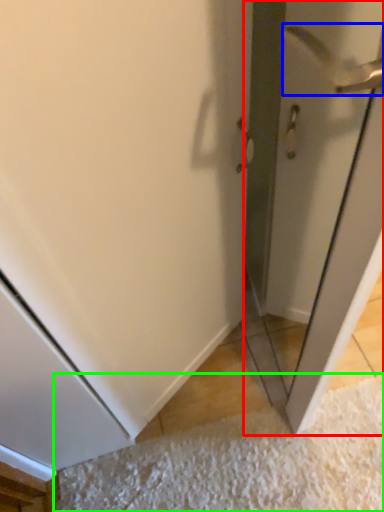
Question: Which object is the farthest from screen door (highlighted by a red box)? Choose among these: door handle (highlighted by a blue box) or doormat (highlighted by a green box).

Choices:
 (A) door handle
 (B) doormat

Answer: (B)